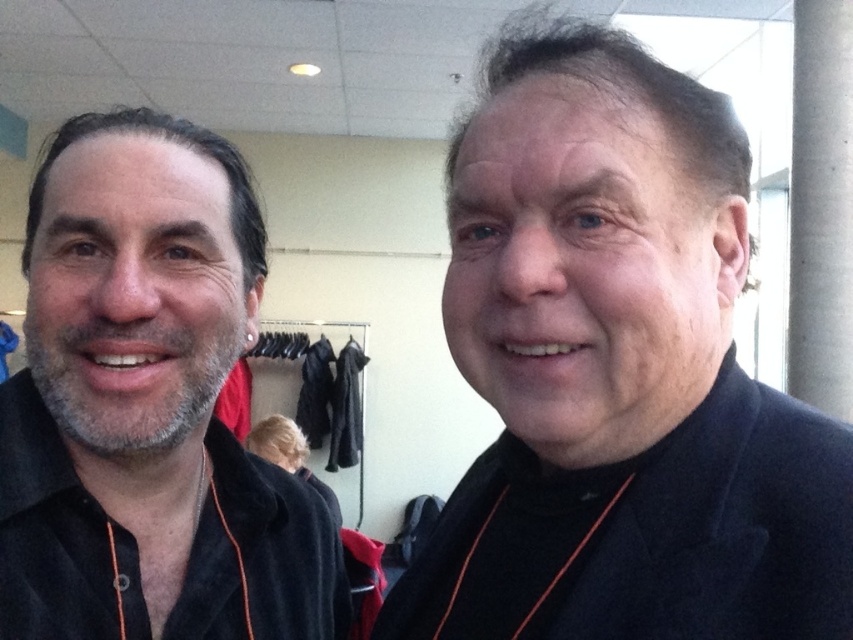
Question: Is black matte jacket at right closer to the viewer compared to black fabric robe at center?

Choices:
 (A) yes
 (B) no

Answer: (A)

Question: Which point is closer to the camera taking this photo?

Choices:
 (A) (730, 486)
 (B) (328, 600)

Answer: (A)

Question: Is black matte jacket at right above black woolen robe at right?

Choices:
 (A) yes
 (B) no

Answer: (A)

Question: Is black matte jacket at right closer to the viewer compared to black woolen robe at right?

Choices:
 (A) yes
 (B) no

Answer: (B)

Question: Which point is closer to the camera?

Choices:
 (A) (167, 355)
 (B) (351, 464)
 (C) (779, 554)
 (D) (549, 355)

Answer: (D)

Question: Which is farther from the black woolen robe at right?

Choices:
 (A) matte black shirt at left
 (B) black matte jacket at right
 (C) black fabric robe at center

Answer: (C)